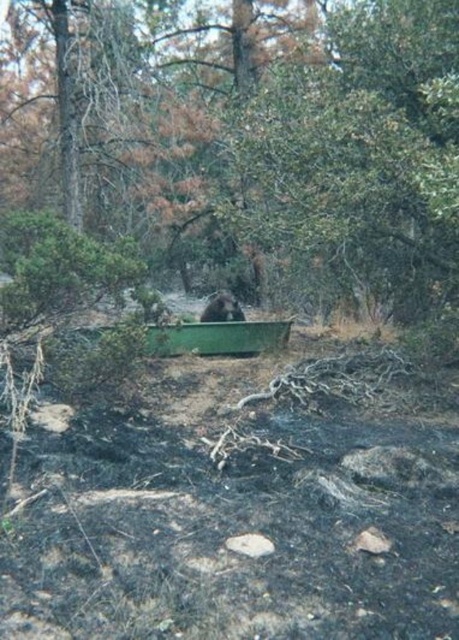
You are navigating a forest area where the ground in the foreground is scorched with charred earth and debris. You see a green matte canoe at center. Based on its position, can you determine if the canoe is positioned closer to the foreground or the background of the image?

The green matte canoe at center is located at point (218, 337), which places it closer to the foreground since it is positioned in the middle ground between the scorched foreground and the background.